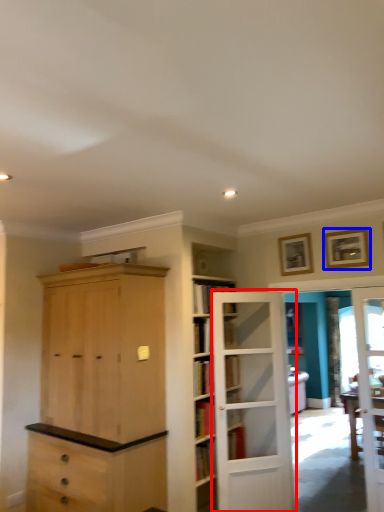
Question: Among these objects, which one is nearest to the camera, door (highlighted by a red box) or picture frame (highlighted by a blue box)?

Choices:
 (A) door
 (B) picture frame

Answer: (A)